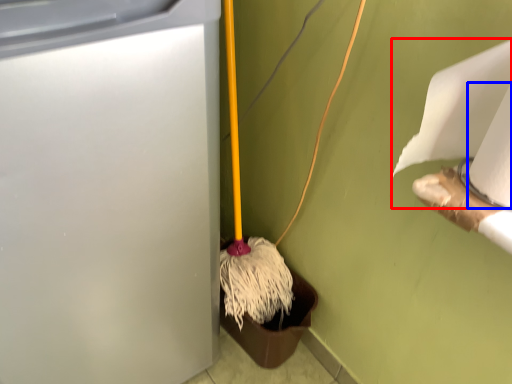
Question: Which object is further to the camera taking this photo, toilet paper (highlighted by a red box) or toilet paper (highlighted by a blue box)?

Choices:
 (A) toilet paper
 (B) toilet paper

Answer: (A)